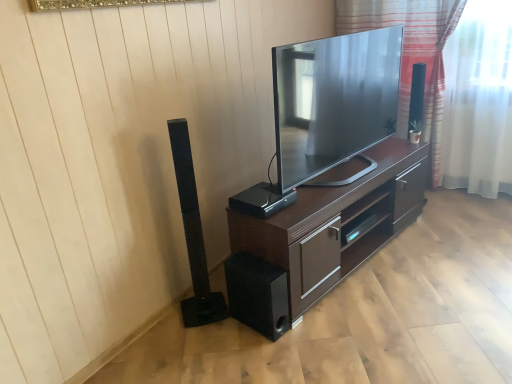
I want to click on unoccupied region to the right of black plastic speaker at center, the 1th speaker in the right-to-left sequence, so click(x=315, y=199).